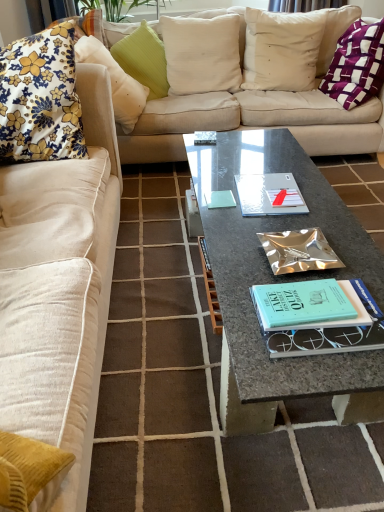
The width and height of the screenshot is (384, 512). In order to click on blank space situated above granite coffee table at center (from a real-world perspective) in this screenshot , I will do `click(270, 203)`.